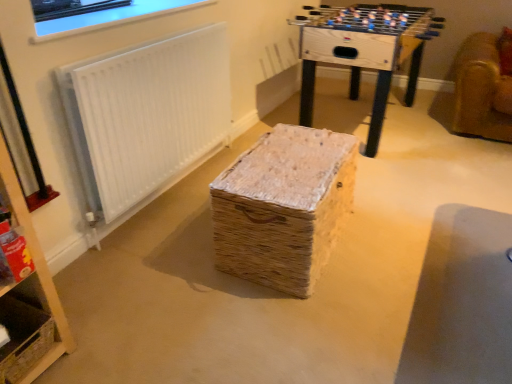
Question: Is white textured radiator at upper left in front of or behind clear glass window at upper left in the image?

Choices:
 (A) behind
 (B) front

Answer: (A)

Question: From a real-world perspective, relative to clear glass window at upper left, is white textured radiator at upper left vertically above or below?

Choices:
 (A) below
 (B) above

Answer: (A)

Question: Which is nearer to the white textured radiator at upper left?

Choices:
 (A) wooden foosball table at upper center
 (B) woven straw basket at lower left
 (C) clear glass window at upper left
 (D) woven straw basket at center

Answer: (C)

Question: Which object is the closest to the woven straw basket at lower left?

Choices:
 (A) white textured radiator at upper left
 (B) clear glass window at upper left
 (C) woven straw basket at center
 (D) wooden foosball table at upper center

Answer: (A)